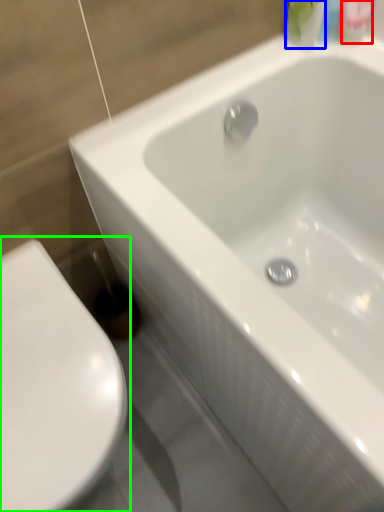
Question: Estimate the real-world distances between objects in this image. Which object is closer to mouthwash (highlighted by a red box), mouthwash (highlighted by a blue box) or toilet (highlighted by a green box)?

Choices:
 (A) mouthwash
 (B) toilet

Answer: (A)